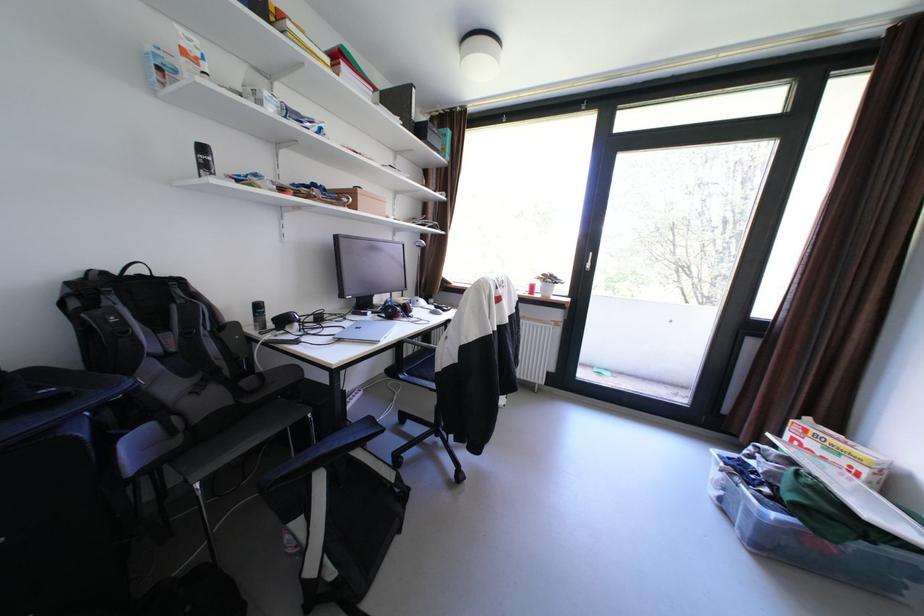
Where is `black chair armrest`? The height and width of the screenshot is (616, 924). black chair armrest is located at coordinates (338, 442).